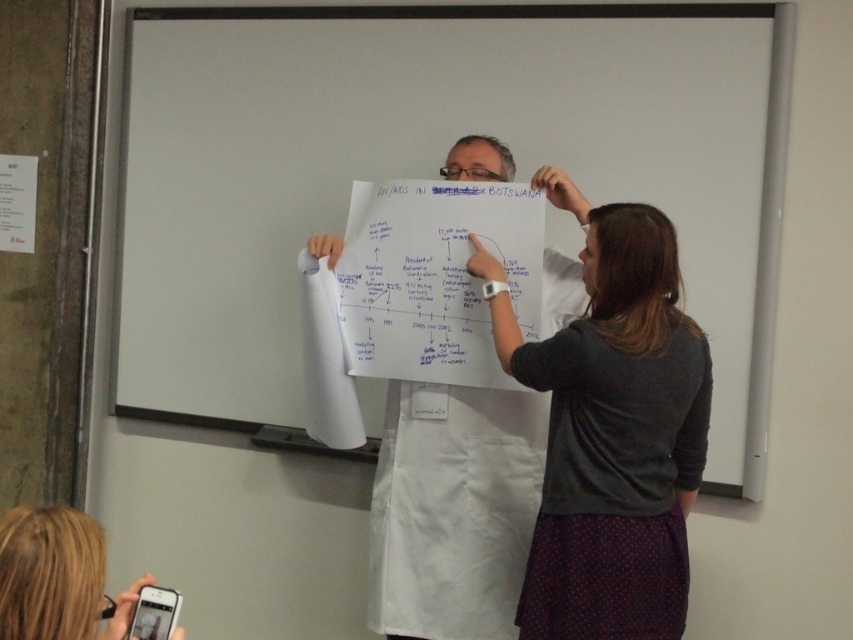
You are a student in the classroom and need to reach both the whiteboard at center and the white paper at center. If you can only move forward or backward, which object will you reach first?

The white paper at center will be reached first because it is closer to you than the whiteboard at center by approximately 25.49 inches.

You are standing in the classroom and want to place a new poster on the wall. The poster must be placed exactly at point (431, 172). Where should you place it?

The point (431, 172) is where the whiteboard at center is located, so you should place the poster on the whiteboard at center.